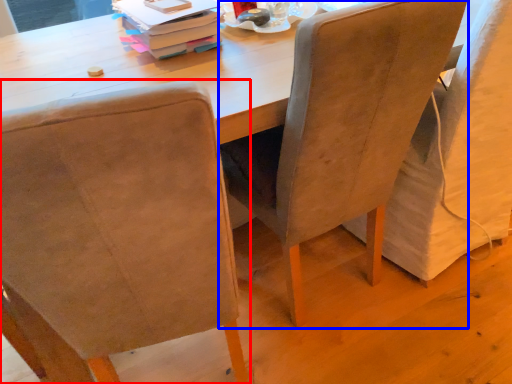
Question: Which object is closer to the camera taking this photo, chair (highlighted by a red box) or chair (highlighted by a blue box)?

Choices:
 (A) chair
 (B) chair

Answer: (A)